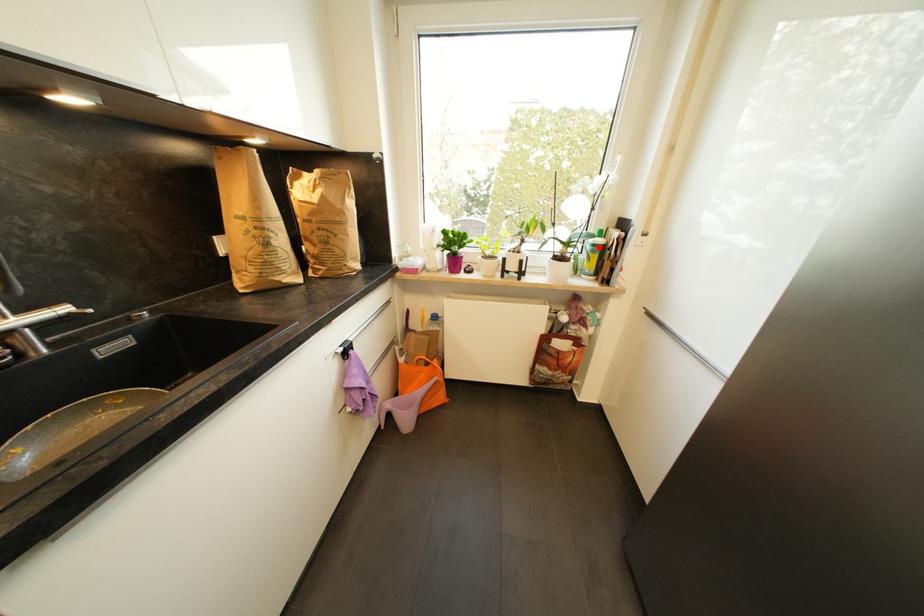
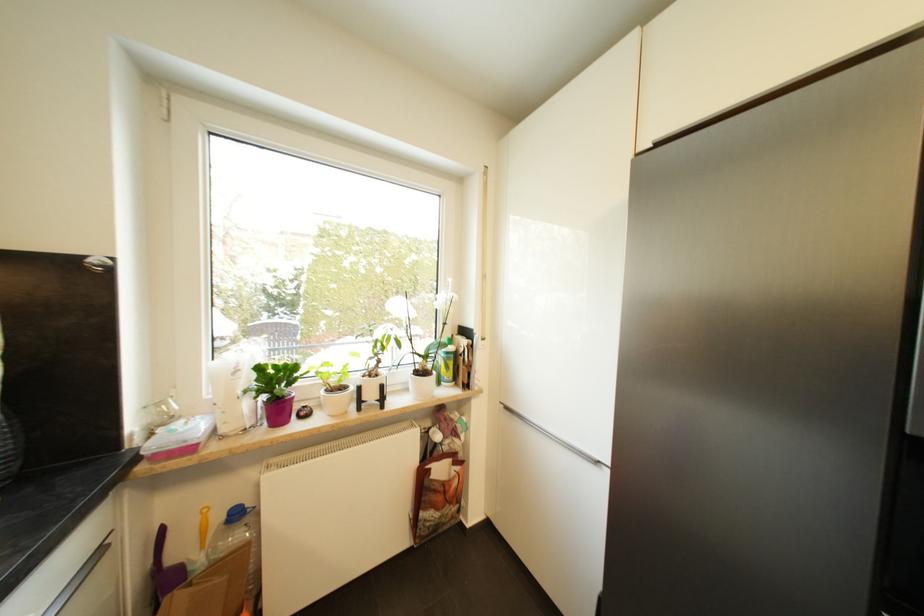
Find the pixel in the second image that matches the highlighted location in the first image.

(453, 355)